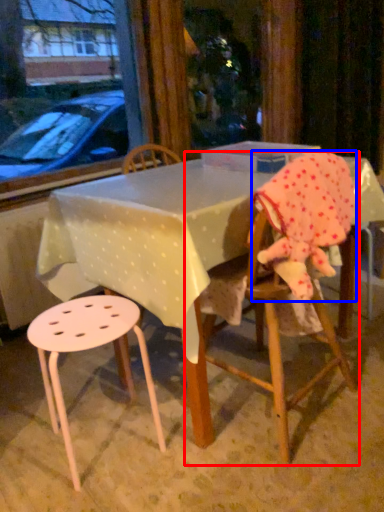
Question: Which object appears farthest to the camera in this image, chair (highlighted by a red box) or toddler (highlighted by a blue box)?

Choices:
 (A) chair
 (B) toddler

Answer: (A)